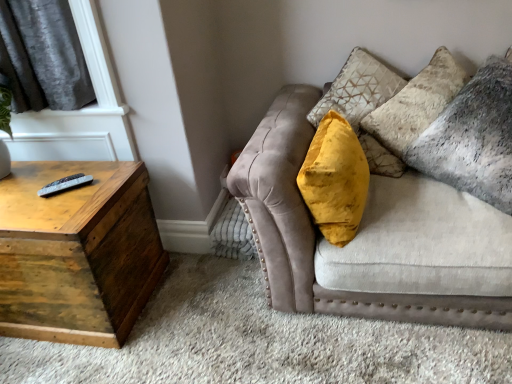
This screenshot has height=384, width=512. What are the coordinates of `free space to the back side of black plastic remote at left` in the screenshot? It's located at (88, 174).